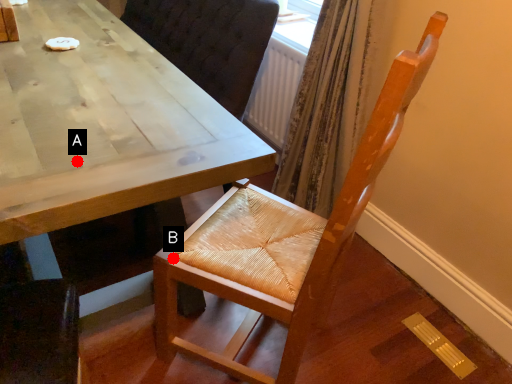
Question: Two points are circled on the image, labeled by A and B beside each circle. Which point is farther to the camera?

Choices:
 (A) A is further
 (B) B is further

Answer: (B)